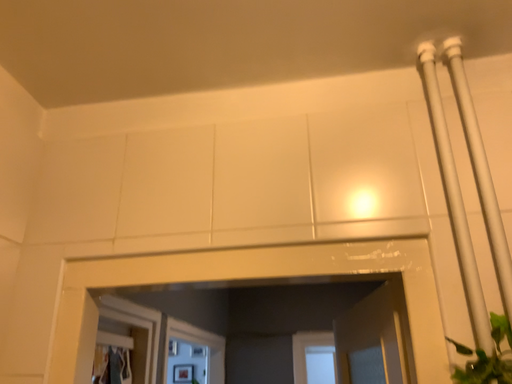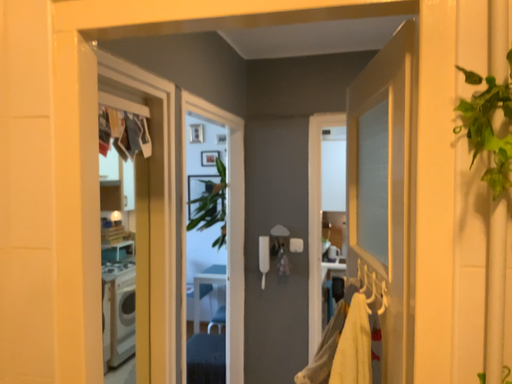
Question: Which way did the camera rotate in the video?

Choices:
 (A) rotated upward
 (B) rotated downward

Answer: (B)